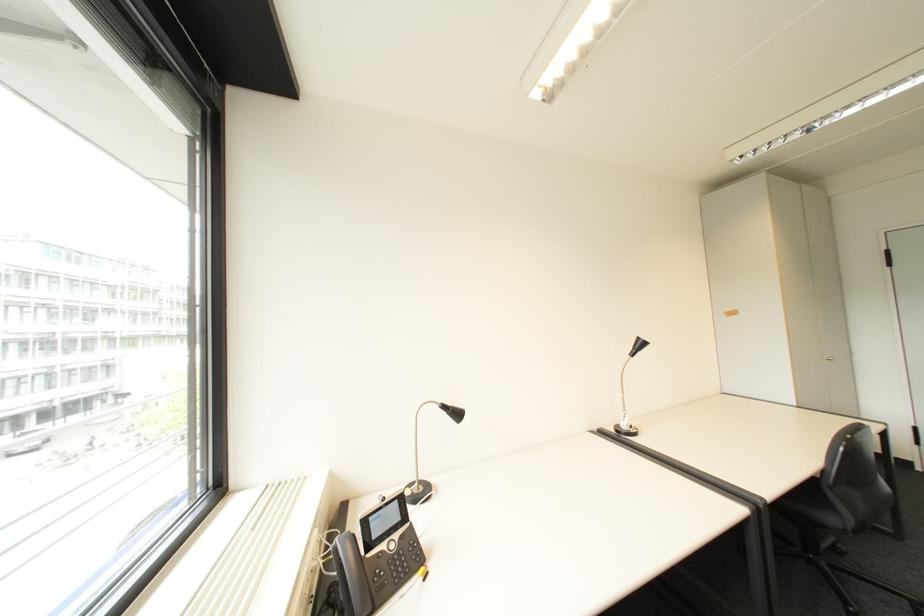
Where is `black telephone handset`? The image size is (924, 616). black telephone handset is located at coordinates (350, 572).